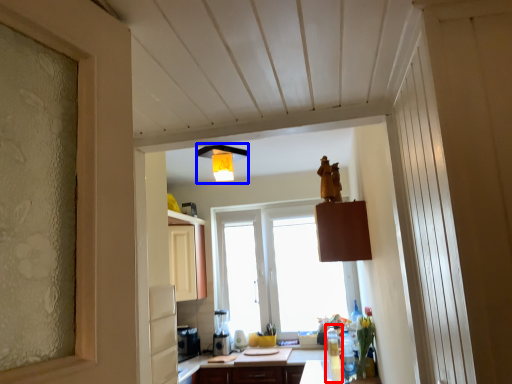
Question: Which object appears closest to the camera in this image, bottle (highlighted by a red box) or light fixture (highlighted by a blue box)?

Choices:
 (A) bottle
 (B) light fixture

Answer: (B)